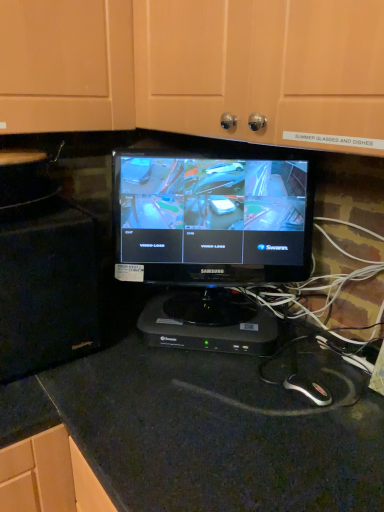
Question: From the image's perspective, relative to black glossy monitor at center, is matte black monitor at center above or below?

Choices:
 (A) below
 (B) above

Answer: (B)

Question: Is point (188, 33) positioned closer to the camera than point (188, 275)?

Choices:
 (A) closer
 (B) farther

Answer: (A)

Question: Considering the real-world distances, which object is closest to the black glossy monitor at center?

Choices:
 (A) black granite countertop at center
 (B) matte black monitor at center
 (C) black plastic device at center

Answer: (C)

Question: Which object is the farthest from the black granite countertop at center?

Choices:
 (A) black plastic device at center
 (B) black glossy monitor at center
 (C) matte black monitor at center

Answer: (C)